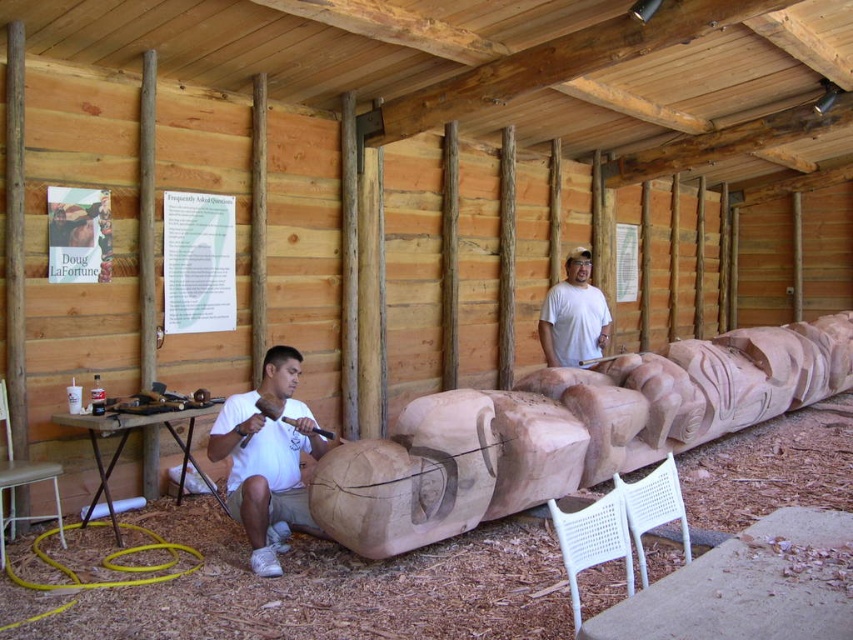
You are a visitor in the workshop and want to sit down to observe the carver. There is a white matte shirt at center and a white plastic chair at lower right. Which object should you approach to sit?

The white plastic chair at lower right is the object you should approach to sit since the white matte shirt at center is positioned to its right side, meaning the chair is on the left side of the shirt and available for sitting.